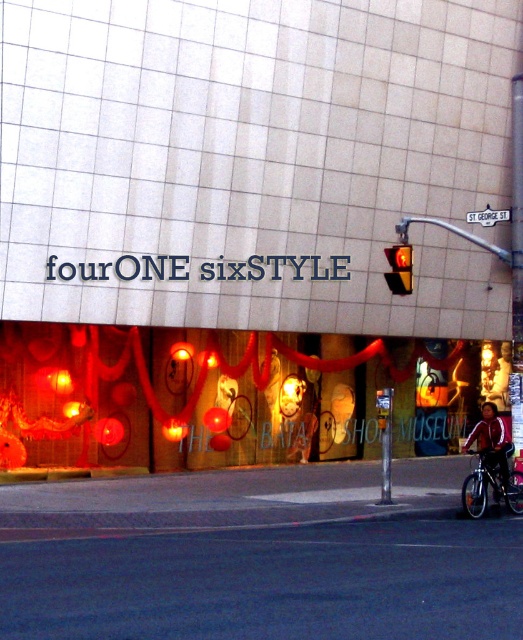
You are standing at the entrance of the building and notice a shiny black bicycle at lower right. If you want to park your bicycle in the same spot, which direction should you walk relative to the building?

The shiny black bicycle at lower right is located at point (491, 486), so you should walk towards the lower right direction relative to the building to park your bicycle in the same spot.

You are a delivery person who needs to load a package onto the shiny black bicycle at lower right. The package is taller than the amber glass traffic light at center. Will the package fit on the bicycle without exceeding its height?

The shiny black bicycle at lower right is taller than the amber glass traffic light at center. Since the package is taller than the traffic light, it may still fit on the bicycle as long as the package does not exceed the bicycle height. However, without exact measurements, it is uncertain. Please check the package dimensions against the bicycle height.